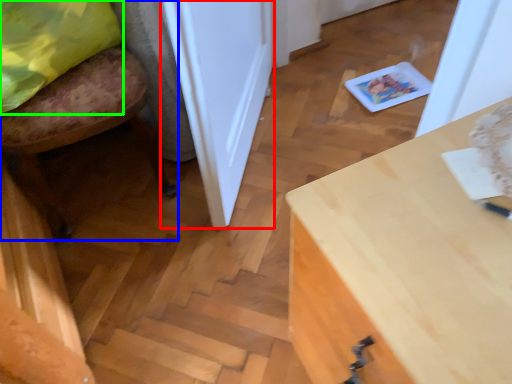
Question: Which object is positioned closest to door (highlighted by a red box)? Select from chair (highlighted by a blue box) and pillow (highlighted by a green box).

Choices:
 (A) chair
 (B) pillow

Answer: (A)